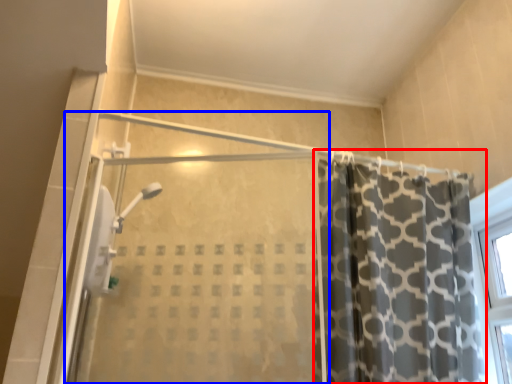
Question: Which of the following is the farthest to the observer, curtain (highlighted by a red box) or screen door (highlighted by a blue box)?

Choices:
 (A) curtain
 (B) screen door

Answer: (A)